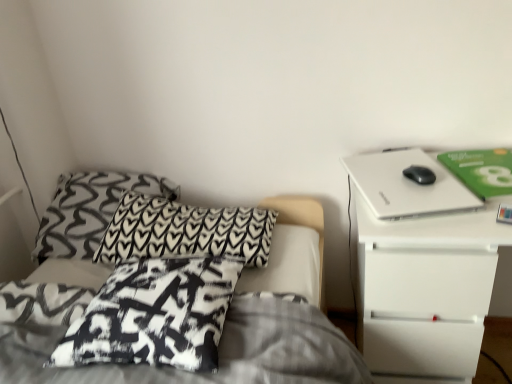
Find the location of a particular element. This screenshot has height=384, width=512. blank space situated above white matte laptop at upper right (from a real-world perspective) is located at coordinates (402, 176).